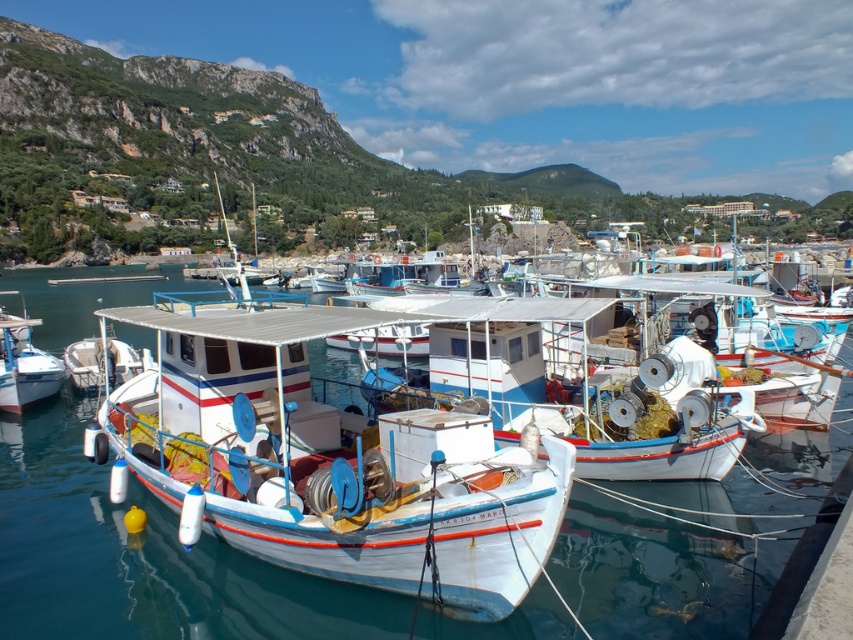
Question: Which of the following is the farthest from the observer?

Choices:
 (A) transparent blue water at center
 (B) white glossy boat at left

Answer: (B)

Question: Is transparent blue water at center closer to the viewer compared to white glossy boat at left?

Choices:
 (A) yes
 (B) no

Answer: (A)

Question: Which point is closer to the camera?

Choices:
 (A) transparent blue water at center
 (B) white glossy boat at left

Answer: (A)

Question: Can you confirm if transparent blue water at center is positioned above white glossy boat at left?

Choices:
 (A) yes
 (B) no

Answer: (B)

Question: Can you confirm if transparent blue water at center is wider than white glossy boat at left?

Choices:
 (A) no
 (B) yes

Answer: (B)

Question: Among these objects, which one is nearest to the camera?

Choices:
 (A) transparent blue water at center
 (B) white glossy boat at left

Answer: (A)